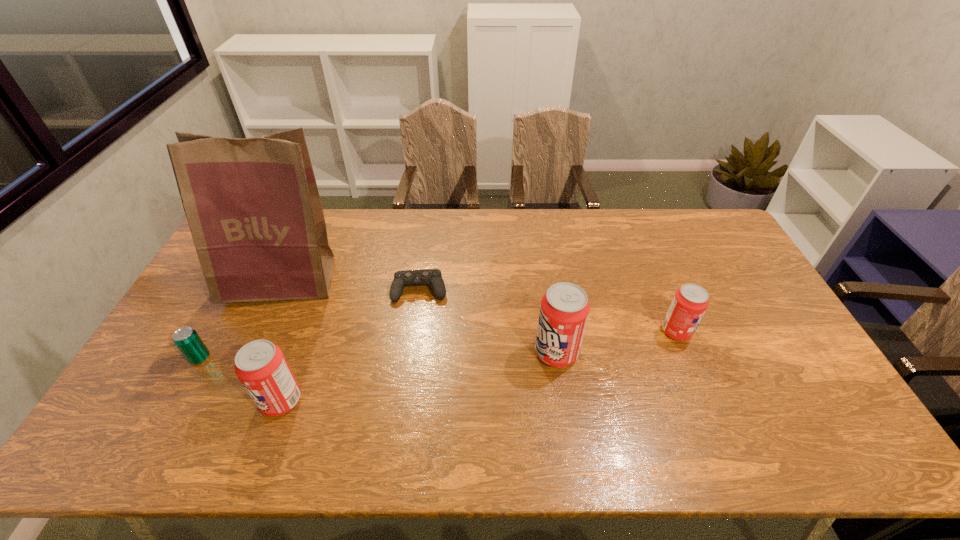
At what (x,y) coordinates should I click in order to perform the action: click on grocery bag present at the left edge. Please return your answer as a coordinate pair (x, y). The image size is (960, 540). Looking at the image, I should click on (253, 208).

You are a GUI agent. You are given a task and a screenshot of the screen. Output one action in this format:
    pyautogui.click(x=<x>, y=<y>)
    Task: Click on the beer can located at the left edge
    
    Given the screenshot: What is the action you would take?
    pyautogui.click(x=186, y=339)

I want to click on free region at the far edge of the desktop, so click(x=556, y=231).

Image resolution: width=960 pixels, height=540 pixels. In order to click on vacant space at the near edge of the desktop in this screenshot , I will do `click(413, 387)`.

I want to click on vacant position at the left edge of the desktop, so [x=188, y=380].

In the image, there is a desktop. In order to click on free space at the right edge in this screenshot , I will do `click(729, 254)`.

I want to click on vacant area at the far right corner, so [696, 228].

The width and height of the screenshot is (960, 540). Identify the location of free point at the near right corner. (810, 409).

Where is `unoccupied area between the fifth tallest object and the shortest object`? This screenshot has height=540, width=960. unoccupied area between the fifth tallest object and the shortest object is located at coordinates (310, 324).

At what (x,y) coordinates should I click in order to perform the action: click on free area in between the fifth object from left to right and the grocery bag. Please return your answer as a coordinate pair (x, y). The image size is (960, 540). Looking at the image, I should click on (420, 317).